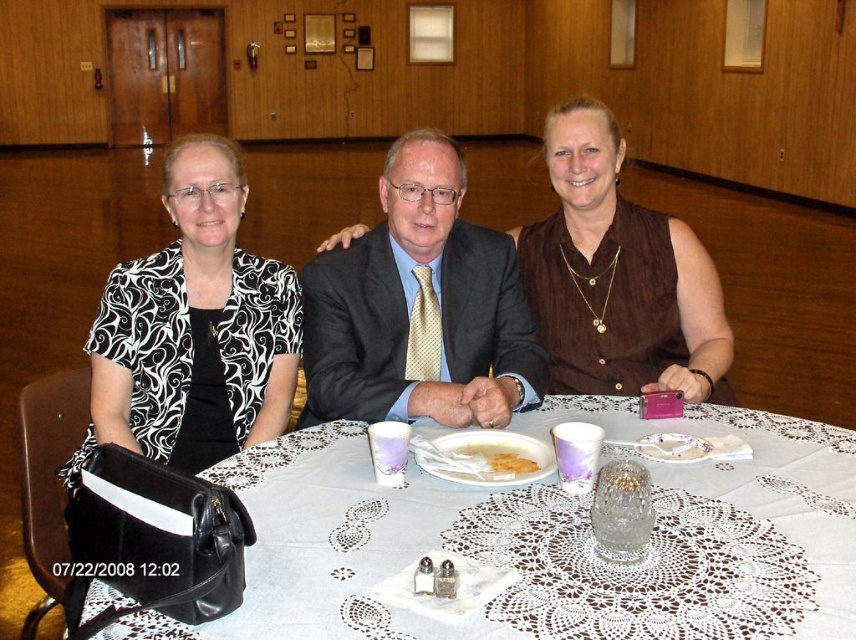
Which is below, white lace tablecloth at center or brown matte dress at center?

white lace tablecloth at center is below.

Which is in front, point (318, 449) or point (587, 323)?

Point (318, 449) is more forward.

Between point (740, 486) and point (617, 200), which one is positioned in front?

Point (740, 486)

Identify the location of white lace tablecloth at center. The height and width of the screenshot is (640, 856). coord(550,540).

Describe the element at coordinates (412, 305) in the screenshot. I see `matte black suit at center` at that location.

Can you confirm if matte black suit at center is bigger than yellow crumbly cake at center?

Yes.

The image size is (856, 640). Describe the element at coordinates (412, 305) in the screenshot. I see `matte black suit at center` at that location.

Locate an element on the screen. The height and width of the screenshot is (640, 856). matte black suit at center is located at coordinates (412, 305).

Does black printed fabric at left have a greater width compared to white creamy soup at center?

Yes.

Where is `black printed fabric at left`? This screenshot has width=856, height=640. black printed fabric at left is located at coordinates (194, 328).